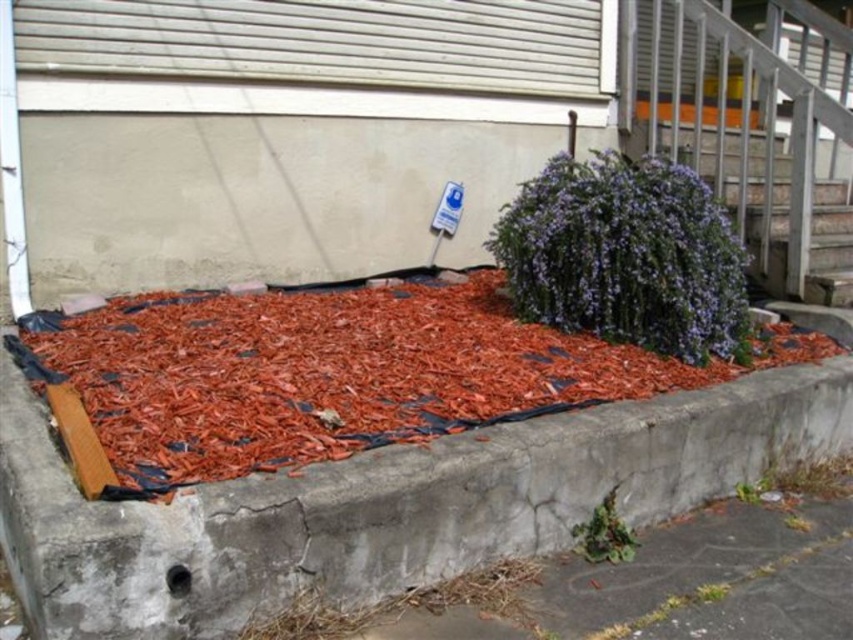
Question: Among these objects, which one is nearest to the camera?

Choices:
 (A) green leafy plant at lower center
 (B) wooden at upper right
 (C) purple matte bush at center

Answer: (A)

Question: Which point is farther to the camera?

Choices:
 (A) green leafy plant at lower center
 (B) purple matte bush at center
 (C) wooden at upper right
 (D) red mulch at center

Answer: (C)

Question: Is purple matte bush at center bigger than wooden at upper right?

Choices:
 (A) no
 (B) yes

Answer: (A)

Question: Which point appears farthest from the camera in this image?

Choices:
 (A) (254, 368)
 (B) (604, 532)
 (C) (537, 268)
 (D) (782, 264)

Answer: (D)

Question: In this image, where is purple matte bush at center located relative to green leafy plant at lower center?

Choices:
 (A) left
 (B) right

Answer: (B)

Question: Can you confirm if wooden at upper right is smaller than green leafy plant at lower center?

Choices:
 (A) no
 (B) yes

Answer: (A)